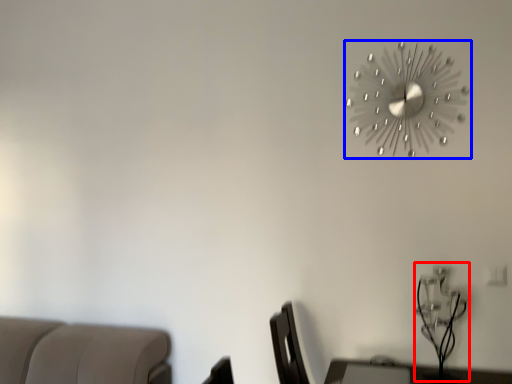
Question: Among these objects, which one is farthest to the camera, table lamp (highlighted by a red box) or wall clock (highlighted by a blue box)?

Choices:
 (A) table lamp
 (B) wall clock

Answer: (B)